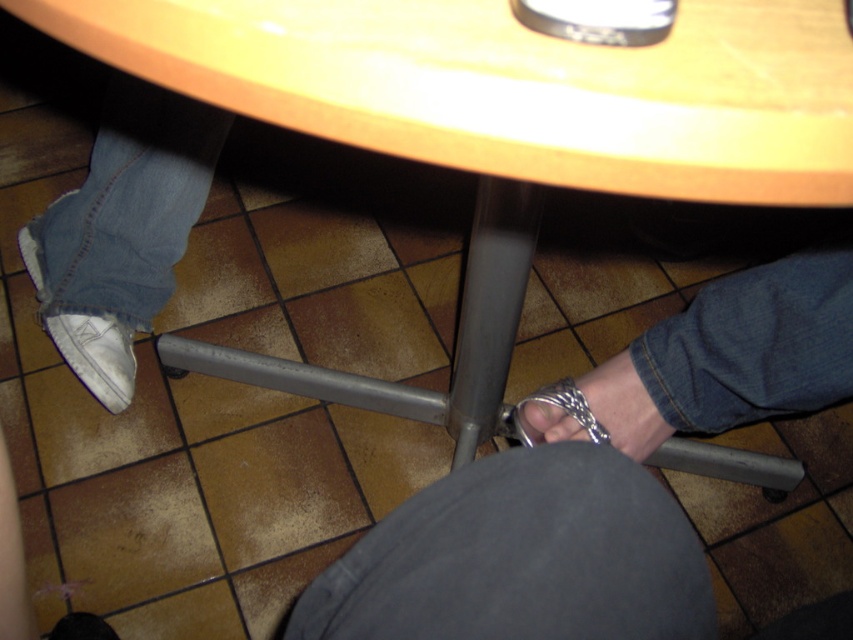
Is point (648, 432) positioned after point (82, 355)?

That is False.

Is silver metallic handcuffs at lower center bigger than white suede shoe at lower left?

Actually, silver metallic handcuffs at lower center might be smaller than white suede shoe at lower left.

Between point (645, 422) and point (120, 396), which one is positioned in front?

Point (645, 422) is in front.

Locate an element on the screen. This screenshot has height=640, width=853. silver metallic handcuffs at lower center is located at coordinates (596, 410).

Measure the distance from silver metallic chain at lower right to silver metallic handcuffs at lower center.

They are 2.86 inches apart.

Who is more forward, (596, 412) or (611, 436)?

Point (596, 412)

Between point (730, 428) and point (541, 442), which one is positioned behind?

The point (730, 428) is behind.

The image size is (853, 640). Find the location of `silver metallic chain at lower right`. silver metallic chain at lower right is located at coordinates (733, 355).

Is silver metallic chain at lower right thinner than silver metallic toe at lower center?

No, silver metallic chain at lower right is not thinner than silver metallic toe at lower center.

Who is taller, silver metallic chain at lower right or silver metallic toe at lower center?

Standing taller between the two is silver metallic chain at lower right.

Is point (717, 324) positioned after point (535, 419)?

No, it is not.

Locate an element on the screen. Image resolution: width=853 pixels, height=640 pixels. silver metallic chain at lower right is located at coordinates (733, 355).